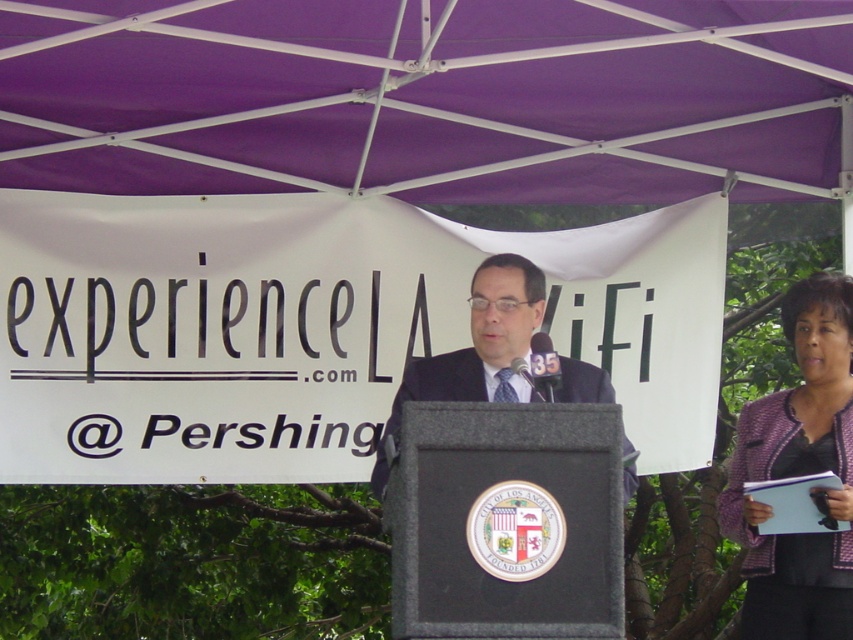
Question: Is purple tweed blazer at lower right below dark blue suit at center?

Choices:
 (A) no
 (B) yes

Answer: (B)

Question: Does purple fabric canopy at upper center appear on the right side of purple tweed blazer at lower right?

Choices:
 (A) yes
 (B) no

Answer: (B)

Question: In this image, where is purple tweed blazer at lower right located relative to dark blue suit at center?

Choices:
 (A) right
 (B) left

Answer: (A)

Question: Which object is closer to the camera taking this photo?

Choices:
 (A) purple fabric canopy at upper center
 (B) dark blue suit at center
 (C) purple tweed blazer at lower right

Answer: (A)

Question: Which object is the farthest from the dark blue suit at center?

Choices:
 (A) purple tweed blazer at lower right
 (B) purple fabric canopy at upper center

Answer: (B)

Question: Which of these objects is positioned farthest from the purple tweed blazer at lower right?

Choices:
 (A) purple fabric canopy at upper center
 (B) dark blue suit at center

Answer: (A)